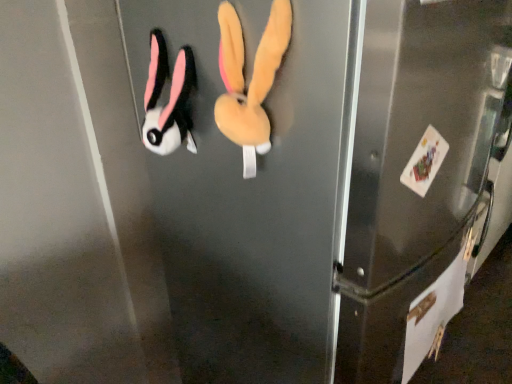
The image size is (512, 384). Describe the element at coordinates (249, 201) in the screenshot. I see `matte black plush at center` at that location.

Where is `matte black plush at center`? matte black plush at center is located at coordinates (249, 201).

I want to click on matte black plush at center, so (x=249, y=201).